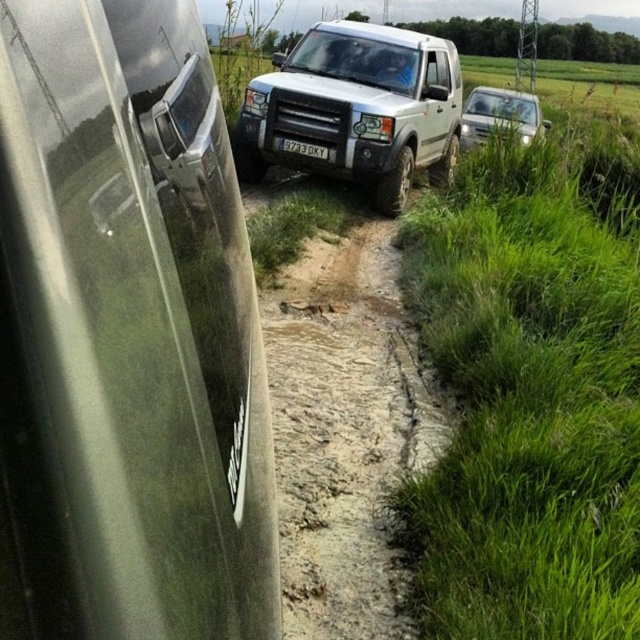
You are driving a car and see two points on the map. The first point is at coordinate point(129, 477) and the second point is at point(513, 490). Which point is closer to your current location if you are driving along the dirt path towards the distant mountain?

Point(129, 477) is in front of point(513, 490), so it is closer to your current location when driving along the dirt path towards the distant mountain.

Consider the image. You are a hiker planning to walk along the narrow dirt path in the rural scene. The path is muddy and wet. There is a point marked at coordinates (339,408) which indicates the brown sandy dirt track at center. Considering the muddy conditions, should you avoid walking on the brown sandy dirt track at center to prevent slipping?

The point at (339,408) indicates the brown sandy dirt track at center, which is muddy and wet. Walking on it may increase the risk of slipping, so it is advisable to avoid walking on the brown sandy dirt track at center.

You are a delivery driver who needs to drive a truck that is 10 feet wide through the brown sandy dirt track at center. The truck also has a license plate similar to the white plastic license plate at center. Can the truck fit through the track based on the size comparison between the track and the license plate?

The brown sandy dirt track at center has a larger size compared to the white plastic license plate at center. Since the track is larger than the license plate, and assuming the truck is proportionally scaled similarly, the truck should be able to fit through the track.